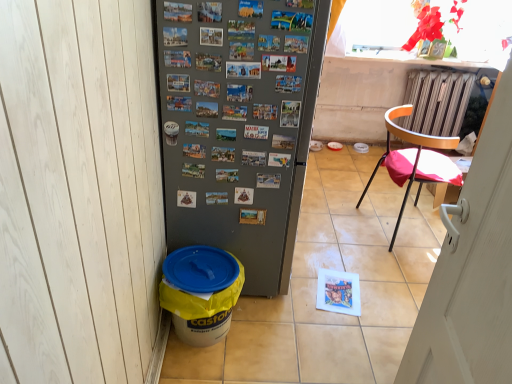
Where is `empty space that is ontop of orange plastic chair at right (from a real-world perspective)`? The width and height of the screenshot is (512, 384). empty space that is ontop of orange plastic chair at right (from a real-world perspective) is located at coordinates (446, 72).